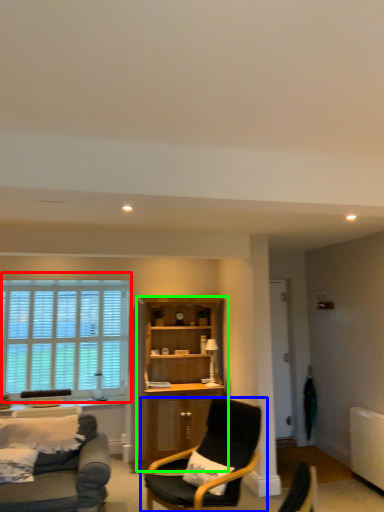
Question: Which object is the farthest from window (highlighted by a red box)? Choose among these: chair (highlighted by a blue box) or cabinetry (highlighted by a green box).

Choices:
 (A) chair
 (B) cabinetry

Answer: (A)